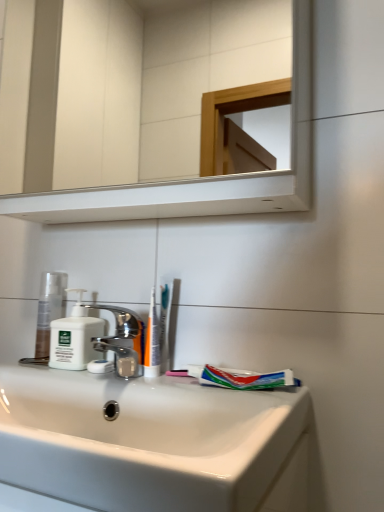
Identify the location of vacant area that lies in front of multicolored plastic toothpaste at lower center. The width and height of the screenshot is (384, 512). (243, 400).